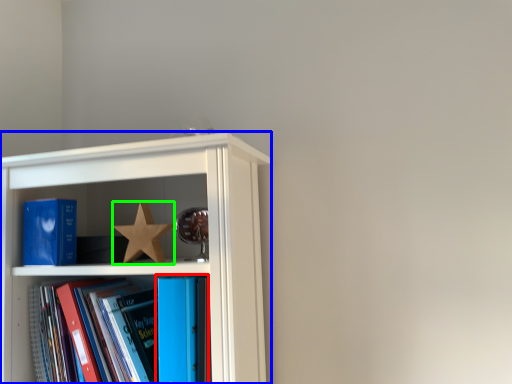
Question: Which is nearer to the book (highlighted by a red box)? shelf (highlighted by a blue box) or star (highlighted by a green box).

Choices:
 (A) shelf
 (B) star

Answer: (B)